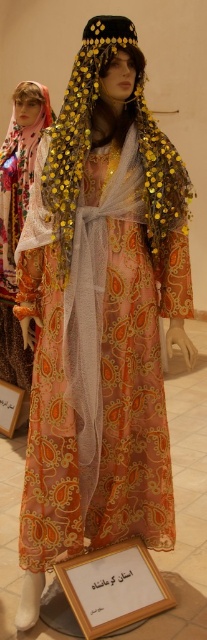
How much distance is there between matte white scarf at left and white paper at center?

They are 14.74 inches apart.

Locate an element on the screen. The width and height of the screenshot is (207, 640). matte white scarf at left is located at coordinates [18, 216].

Between point (20, 234) and point (116, 563), which one is positioned behind?

The point (20, 234) is more distant.

Who is positioned more to the right, matte white scarf at left or wooden plaque at lower center?

wooden plaque at lower center

Looking at this image, who is more forward, (13, 138) or (86, 602)?

Point (86, 602) is in front.

Locate an element on the screen. This screenshot has width=207, height=640. matte white scarf at left is located at coordinates (18, 216).

Does wooden plaque at lower center appear under white paper at center?

Yes, wooden plaque at lower center is below white paper at center.

Can you confirm if wooden plaque at lower center is positioned above white paper at center?

Actually, wooden plaque at lower center is below white paper at center.

Locate an element on the screen. Image resolution: width=207 pixels, height=640 pixels. wooden plaque at lower center is located at coordinates (114, 588).